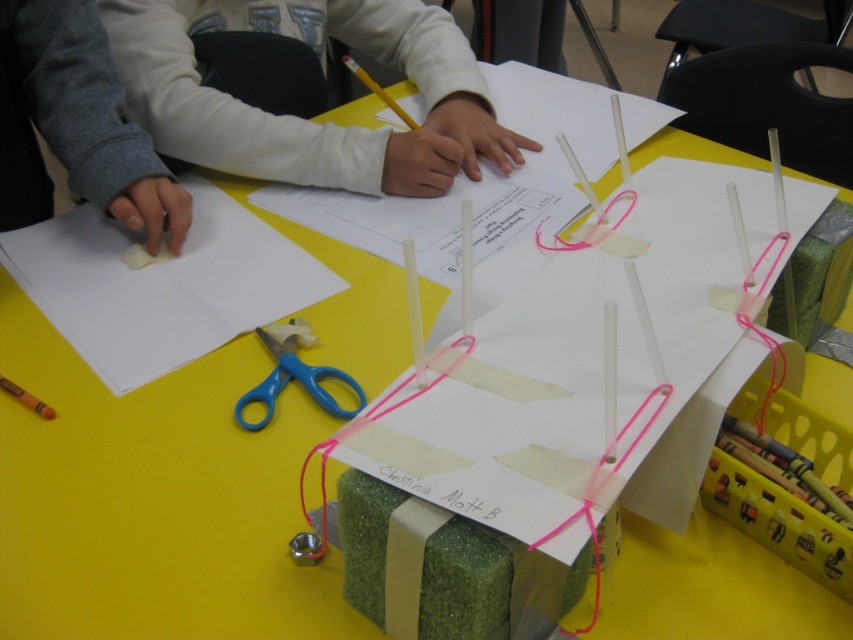
You are a student in the classroom looking at the table. There are two points marked on the table surface. The first point is at coordinate point (734, 337) and the second point is at coordinate point (103, 269). Which point is closer to you?

Point (734, 337) is in front of point (103, 269), so it is closer to you.

You are a student in the classroom and need to place a small sticker on the white paper at center. Can you fit the sticker on the paper without overlapping the blue plastic scissors at center?

The white paper at center is much taller than the blue plastic scissors at center, so yes, the sticker can be placed on the white paper at center without overlapping the blue plastic scissors at center.

You are a student in the classroom and need to choose a larger piece of paper to write your group name. Which one should you pick between the white paper at left and the white paper at center?

The white paper at center is larger than the white paper at left, so you should pick the white paper at center.